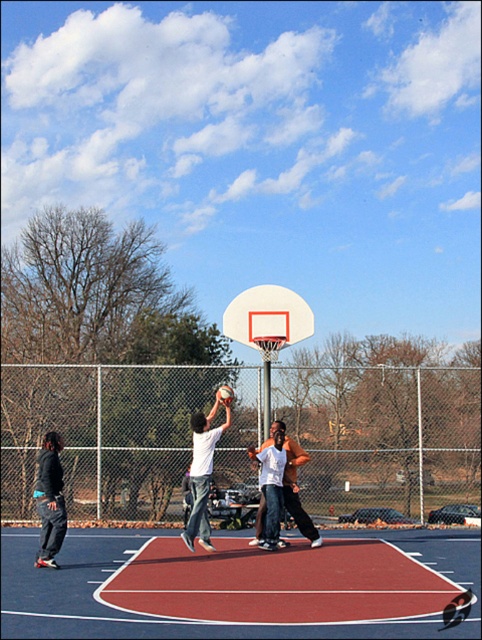
Based on the photo, which of these two, white matte basketball hoop at center or orange t-shirt at center, stands shorter?

With less height is orange t-shirt at center.

Can you confirm if white matte basketball hoop at center is positioned to the left of orange t-shirt at center?

Yes, white matte basketball hoop at center is to the left of orange t-shirt at center.

At what (x,y) coordinates should I click in order to perform the action: click on white matte basketball hoop at center. Please return your answer as a coordinate pair (x, y). The height and width of the screenshot is (640, 482). Looking at the image, I should click on (267, 332).

You are a GUI agent. You are given a task and a screenshot of the screen. Output one action in this format:
    pyautogui.click(x=<x>, y=<y>)
    Task: Click on the white matte basketball hoop at center
    
    Given the screenshot: What is the action you would take?
    pyautogui.click(x=267, y=332)

Is white matte basketball hoop at center smaller than dark gray hoodie at left?

Incorrect, white matte basketball hoop at center is not smaller in size than dark gray hoodie at left.

Between point (286, 321) and point (47, 548), which one is positioned in front?

Point (47, 548) is more forward.

Image resolution: width=482 pixels, height=640 pixels. I want to click on white matte basketball hoop at center, so click(267, 332).

Consider the image. Is rubberized red basketball court at center shorter than orange t-shirt at center?

Indeed, rubberized red basketball court at center has a lesser height compared to orange t-shirt at center.

Is point (294, 541) less distant than point (291, 509)?

No, it is behind (291, 509).

Measure the distance between point [355,616] and camera.

A distance of 7.81 meters exists between point [355,616] and camera.

Where is `rubberized red basketball court at center`? The height and width of the screenshot is (640, 482). rubberized red basketball court at center is located at coordinates (282, 584).